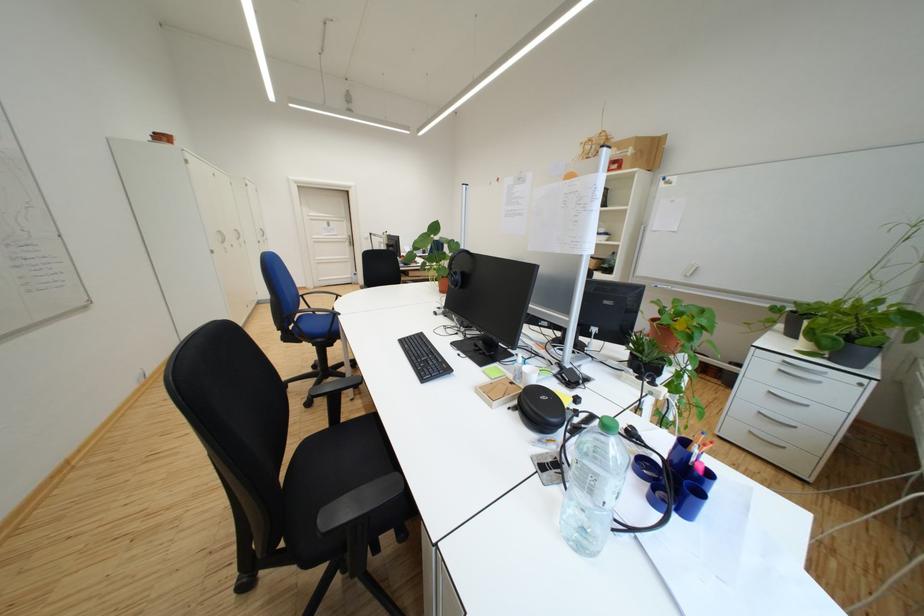
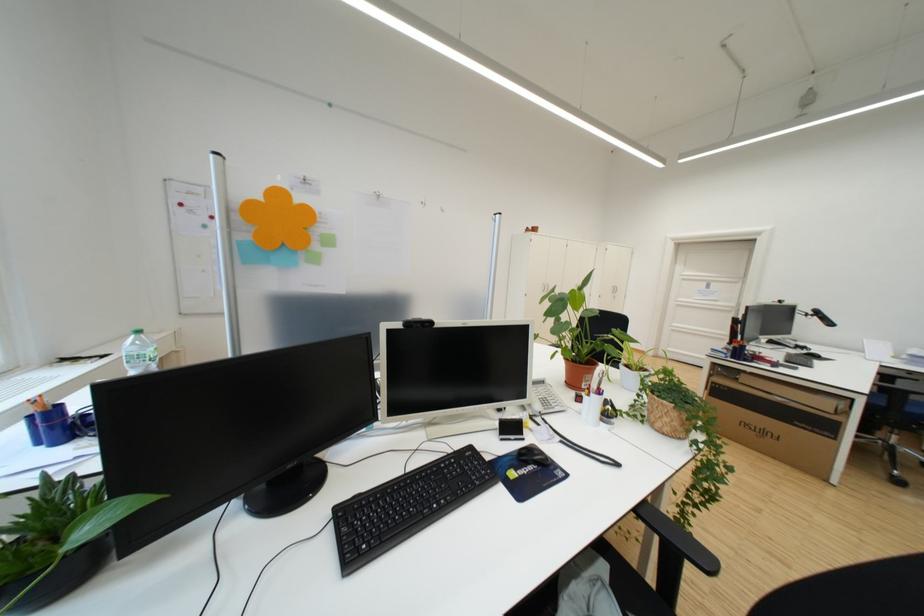
In the second image, find the point that corresponds to (x=341, y=227) in the first image.

(720, 288)